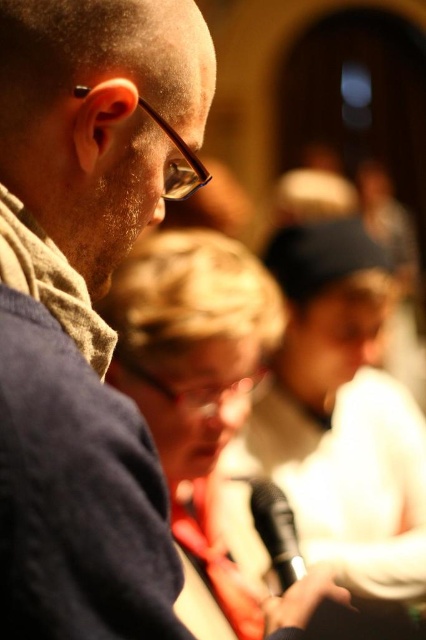
Question: Does matte black glasses at upper left have a larger size compared to black matte microphone at lower center?

Choices:
 (A) yes
 (B) no

Answer: (A)

Question: Which point is closer to the camera taking this photo?

Choices:
 (A) (284, 552)
 (B) (95, 148)

Answer: (B)

Question: Is matte black glasses at upper left positioned at the back of black matte microphone at lower center?

Choices:
 (A) no
 (B) yes

Answer: (A)

Question: Which of the following is the farthest from the observer?

Choices:
 (A) black matte microphone at lower center
 (B) matte black glasses at upper left

Answer: (A)

Question: Can you confirm if matte black glasses at upper left is positioned above black matte microphone at lower center?

Choices:
 (A) no
 (B) yes

Answer: (B)